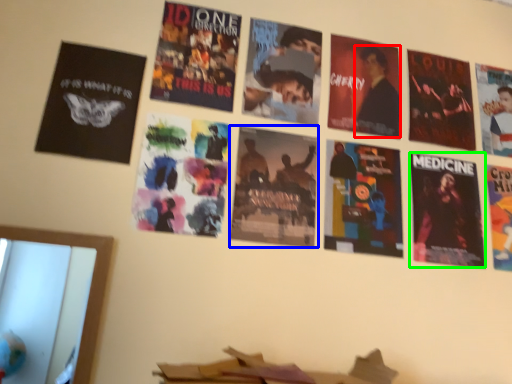
Question: Considering the real-world distances, which object is farthest from person (highlighted by a red box)? poster (highlighted by a blue box) or poster (highlighted by a green box)?

Choices:
 (A) poster
 (B) poster

Answer: (A)